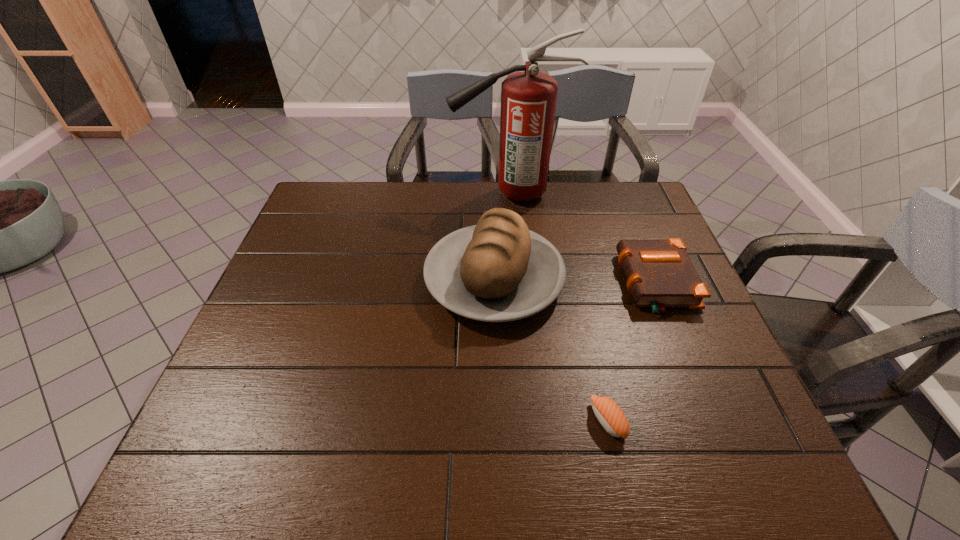
I want to click on vacant area that lies between the bread and the nearest object, so click(x=551, y=350).

Locate an element on the screen. The height and width of the screenshot is (540, 960). vacant area between the shortest object and the second tallest object is located at coordinates (551, 350).

Locate an element on the screen. This screenshot has height=540, width=960. vacant space in between the second tallest object and the nearest object is located at coordinates (551, 350).

Identify which object is located as the second nearest to the fire extinguisher. Please provide its 2D coordinates. Your answer should be formatted as a tuple, i.e. [(x, y)], where the tuple contains the x and y coordinates of a point satisfying the conditions above.

[(659, 273)]

Locate which object is the second closest to the tallest object. Please provide its 2D coordinates. Your answer should be formatted as a tuple, i.e. [(x, y)], where the tuple contains the x and y coordinates of a point satisfying the conditions above.

[(659, 273)]

Image resolution: width=960 pixels, height=540 pixels. In order to click on free space in the image that satisfies the following two spatial constraints: 1. on the front side of the shortest object; 2. on the left side of the third shortest object in this screenshot , I will do click(499, 421).

Find the location of `free point that satisfies the following two spatial constraints: 1. on the back side of the shortest object; 2. at the nozzle of the tallest object`. free point that satisfies the following two spatial constraints: 1. on the back side of the shortest object; 2. at the nozzle of the tallest object is located at coordinates (557, 193).